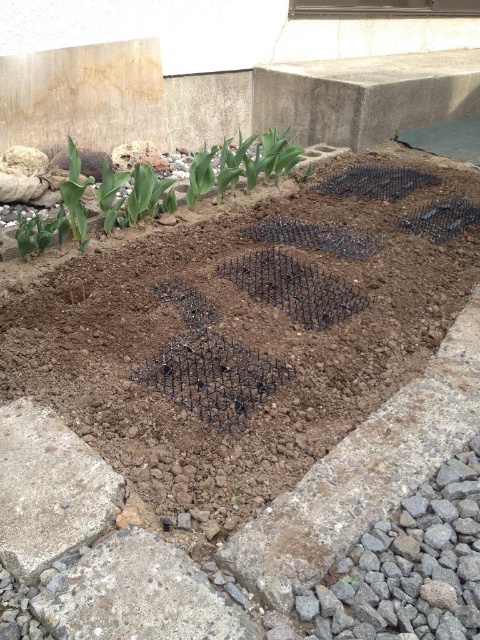
Consider the image. You are a gardener who wants to plant a new flower in the garden bed. The garden bed has a grid system with black plastic grids. To avoid damaging the existing green leafy plant at upper left, where should you place the new flower? Please provide coordinates based on the grid system. The grid system is divided into 1x1 units with the bottom left corner as the origin point. The garden bed is 1 unit wide and 1 unit tall.

The green leafy plant at upper left is located at point (97, 205). To avoid damaging it, you should place the new flower at a coordinate that is not overlapping with this point. For example, placing it at (240, 320) would be safe as it is away from the plant.